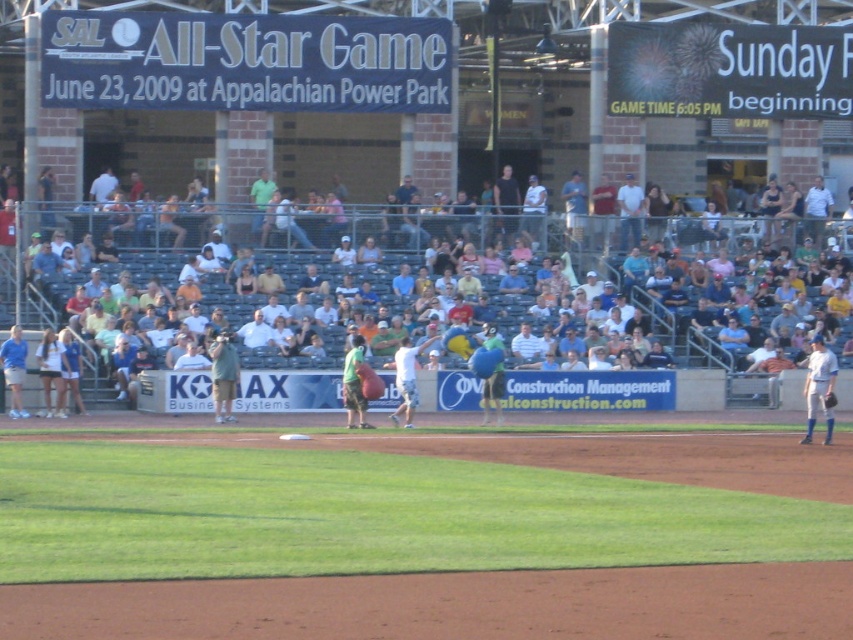
Question: Can you confirm if green fabric bag at center is thinner than blue fabric bag at center?

Choices:
 (A) yes
 (B) no

Answer: (A)

Question: Considering the relative positions of green jersey at lower left and dark blue leather glove at lower right in the image provided, where is green jersey at lower left located with respect to dark blue leather glove at lower right?

Choices:
 (A) right
 (B) left

Answer: (B)

Question: Observing the image, what is the correct spatial positioning of white cotton shirt at upper center in reference to black matte shirt at upper center?

Choices:
 (A) below
 (B) above

Answer: (A)

Question: Based on their relative distances, which object is farther from the white uniform at center?

Choices:
 (A) black matte shirt at upper center
 (B) green fabric bag at center
 (C) white cotton shirt at upper center
 (D) dark blue leather glove at lower right

Answer: (A)

Question: Which of the following is the farthest from the observer?

Choices:
 (A) blue fabric bag at center
 (B) black matte shirt at upper center
 (C) white cotton shirt at upper center

Answer: (A)

Question: Among these points, which one is farthest from the camera?

Choices:
 (A) (822, 348)
 (B) (573, 189)

Answer: (B)